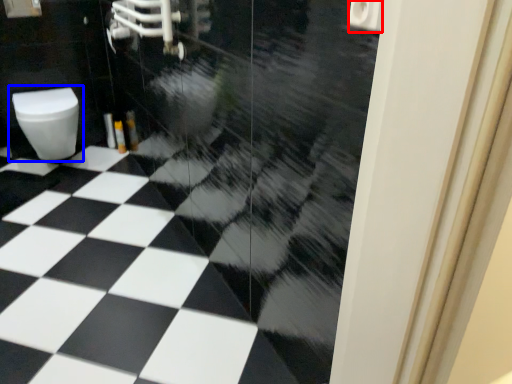
Question: Which object appears farthest to the camera in this image, toilet paper (highlighted by a red box) or toilet (highlighted by a blue box)?

Choices:
 (A) toilet paper
 (B) toilet

Answer: (B)